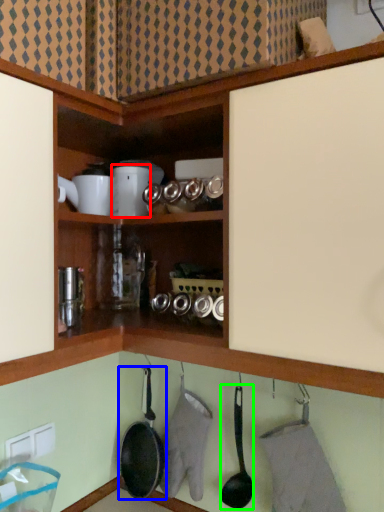
Question: Based on their relative distances, which object is farther from appliance (highlighted by a red box)? Choose from frying pan (highlighted by a blue box) and frying pan (highlighted by a green box).

Choices:
 (A) frying pan
 (B) frying pan

Answer: (A)